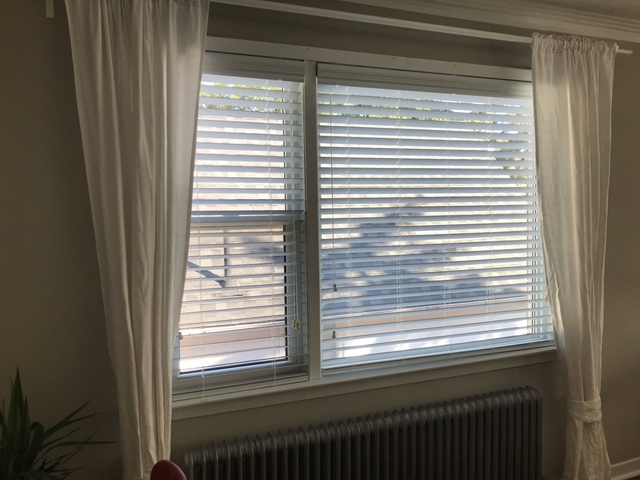
This screenshot has width=640, height=480. What are the coordinates of `top of chair back` in the screenshot? It's located at (162, 470).